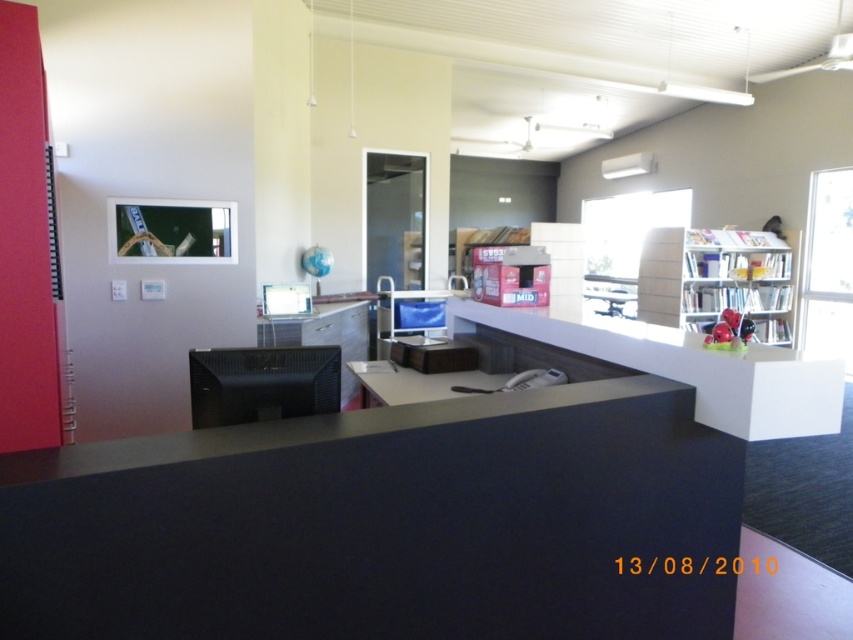
Does matte black desk at center lie behind black plastic computer at center?

No, matte black desk at center is in front of black plastic computer at center.

Can you confirm if matte black desk at center is shorter than black plastic computer at center?

Incorrect, matte black desk at center's height does not fall short of black plastic computer at center's.

Who is more distant from viewer, (734, 544) or (276, 298)?

Positioned behind is point (276, 298).

Identify the location of matte black desk at center. (386, 524).

Which of these two, black matte monitor at center or black plastic computer at center, stands taller?

With more height is black plastic computer at center.

Which is more to the right, black matte monitor at center or black plastic computer at center?

black matte monitor at center is more to the right.

Who is more forward, (201, 397) or (280, 296)?

Point (201, 397) is in front.

This screenshot has height=640, width=853. I want to click on black matte monitor at center, so click(x=262, y=384).

Can you confirm if matte black desk at center is positioned to the right of white glossy counter top at center?

No, matte black desk at center is not to the right of white glossy counter top at center.

Between matte black desk at center and white glossy counter top at center, which one is positioned lower?

matte black desk at center

Locate an element on the screen. This screenshot has width=853, height=640. matte black desk at center is located at coordinates (386, 524).